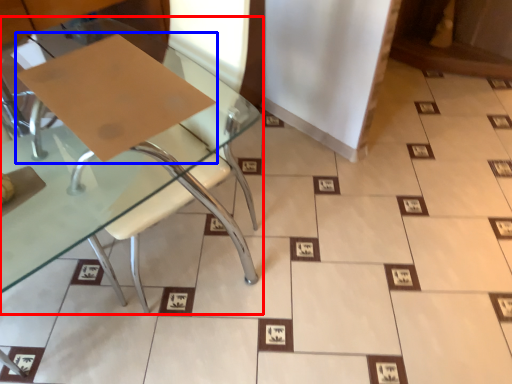
Question: Which of the following is the closest to the observer, table (highlighted by a red box) or cardboard (highlighted by a blue box)?

Choices:
 (A) table
 (B) cardboard

Answer: (A)